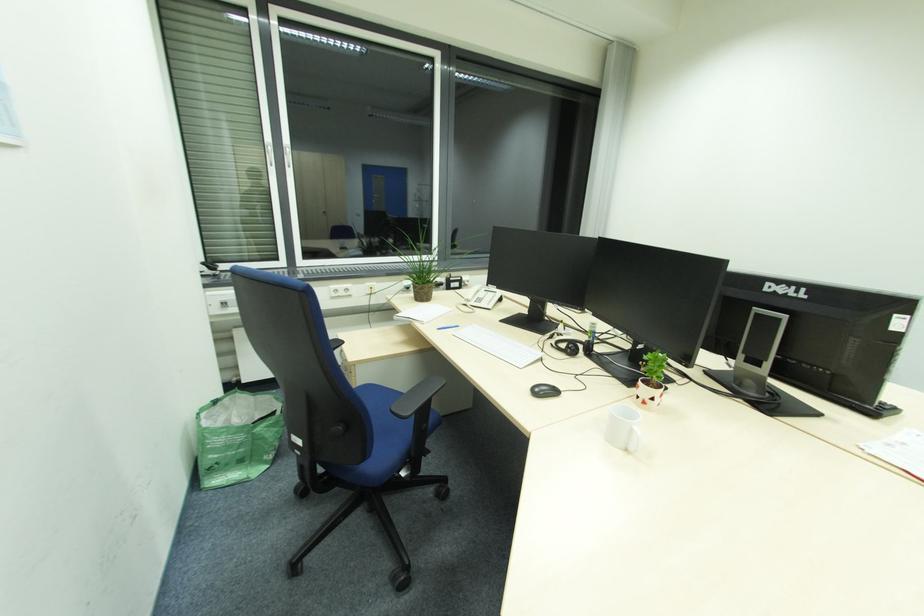
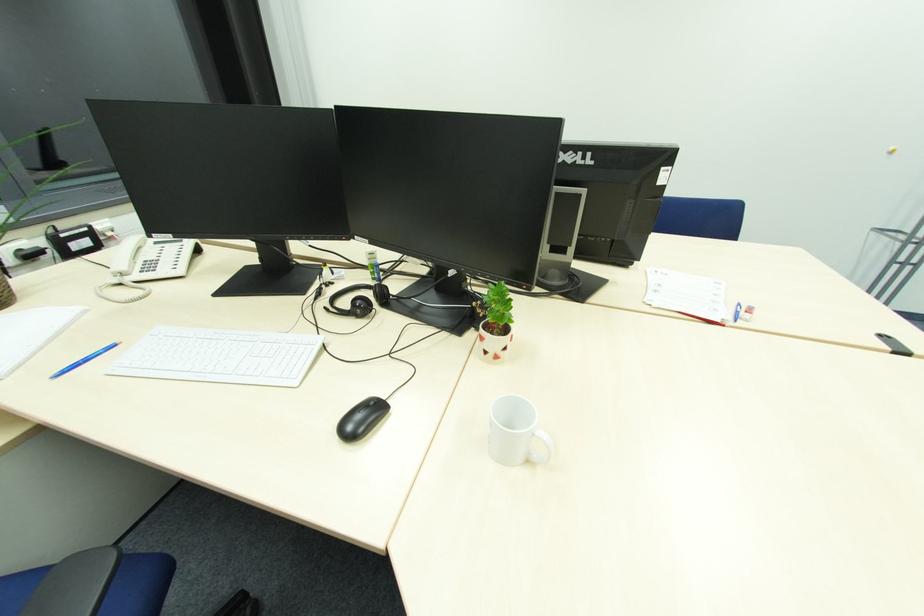
The first image is from the beginning of the video and the second image is from the end. How did the camera likely rotate when shooting the video?

The camera's rotation is toward right-down.